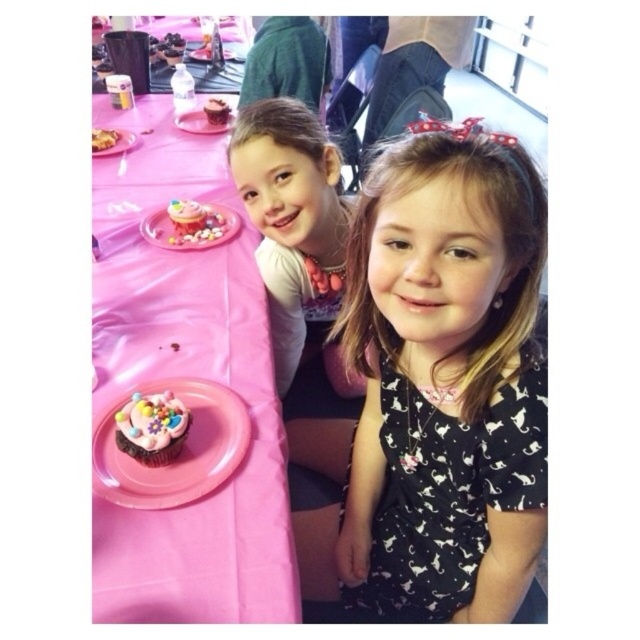
Question: Which object is positioned farthest from the pink paper tablecloth at left?

Choices:
 (A) matte pink cupcake at center
 (B) pink paper plate at upper left
 (C) pastel pink frosting cupcake at center

Answer: (A)

Question: Which point is farther from the camera taking this photo?

Choices:
 (A) (205, 116)
 (B) (193, 131)
 (C) (148, 396)
 (D) (193, 326)

Answer: (A)

Question: Can you confirm if matte plastic plate at upper left is wider than pink paper plate at upper left?

Choices:
 (A) no
 (B) yes

Answer: (B)

Question: Among these objects, which one is nearest to the camera?

Choices:
 (A) pink paper plate at upper left
 (B) black printed dress at center
 (C) matte pink cupcake at center
 (D) matte plastic plate at upper left

Answer: (B)

Question: Does pink paper plate at upper center have a smaller size compared to chocolate frosted cake at upper left?

Choices:
 (A) no
 (B) yes

Answer: (A)

Question: Is the position of chocolate cupcake at center more distant than that of chocolate frosted cupcake at center?

Choices:
 (A) yes
 (B) no

Answer: (B)